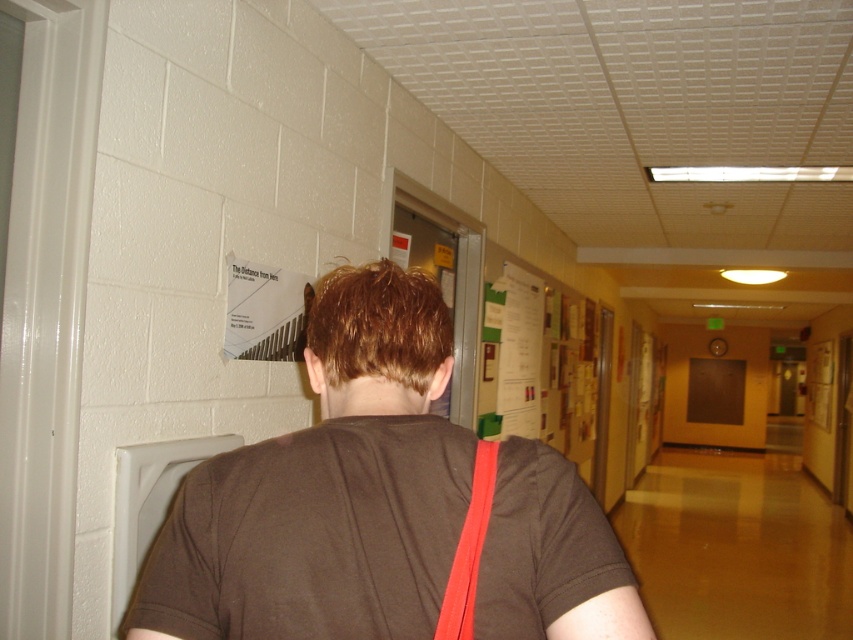
Question: Among these points, which one is nearest to the camera?

Choices:
 (A) (195, 609)
 (B) (466, 538)

Answer: (B)

Question: Among these points, which one is farthest from the camera?

Choices:
 (A) (148, 568)
 (B) (494, 445)

Answer: (A)

Question: Can you confirm if brown cotton shirt at center is positioned to the left of neon pink fabric strap at back?

Choices:
 (A) yes
 (B) no

Answer: (A)

Question: Is brown cotton shirt at center wider than neon pink fabric strap at back?

Choices:
 (A) no
 (B) yes

Answer: (B)

Question: Where is brown cotton shirt at center located in relation to neon pink fabric strap at back in the image?

Choices:
 (A) right
 (B) left

Answer: (B)